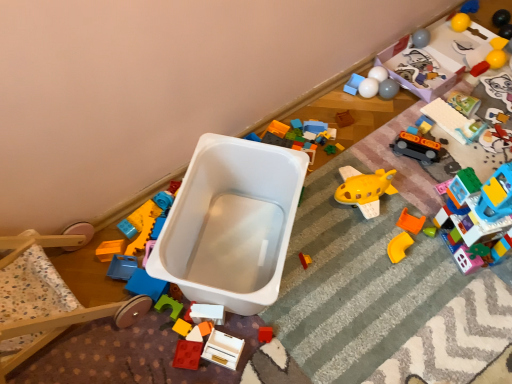
What are the coordinates of `free space to the left of rubberized plastic block at center, the 1th toy positioned from the left` in the screenshot? It's located at (126, 341).